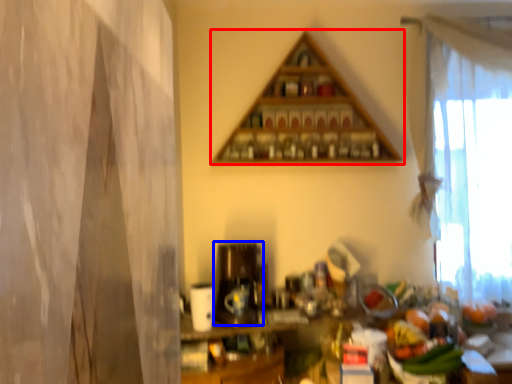
Question: Which object appears farthest to the camera in this image, shelf (highlighted by a red box) or appliance (highlighted by a blue box)?

Choices:
 (A) shelf
 (B) appliance

Answer: (A)